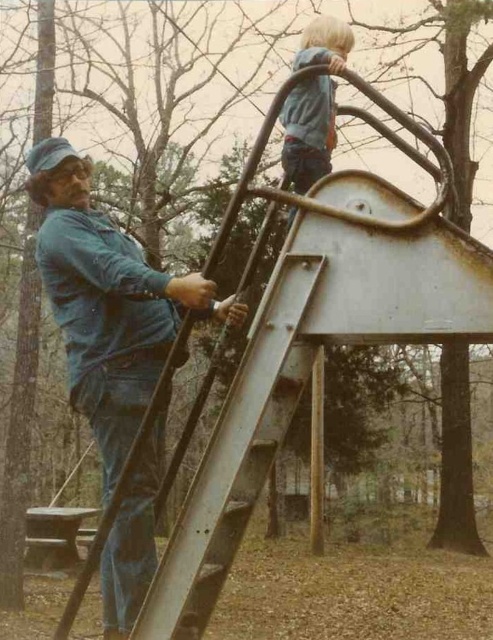
You are a photographer standing at the playground. You want to take a photo that includes both the slide and the climbing frame. The slide is located at point (x=105, y=218) and the climbing frame is at point (x=295, y=65). Which object should you focus on first to ensure both are in clear view?

You should focus on the slide at point (x=105, y=218) first because it is closer to the camera than the climbing frame at point (x=295, y=65). This ensures both will be in focus as the climbing frame is further away.

You are a photographer trying to capture both the blue denim jeans at left and the blue matte jacket at upper center in a single frame. Since the camera can only focus on one object at a time, which object should you focus on to ensure the larger one is in clear view?

The blue denim jeans at left is bigger than the blue matte jacket at upper center, so you should focus on the blue denim jeans at left to ensure the larger object is in clear view.

You are a parent trying to locate your child in the playground. You see the blue denim jeans at left. Based on their position coordinates, where would you expect to find your child?

The blue denim jeans at left are located at point (106, 301), which likely indicates the child is on the slide or climbing frame area at the left side of the playground.